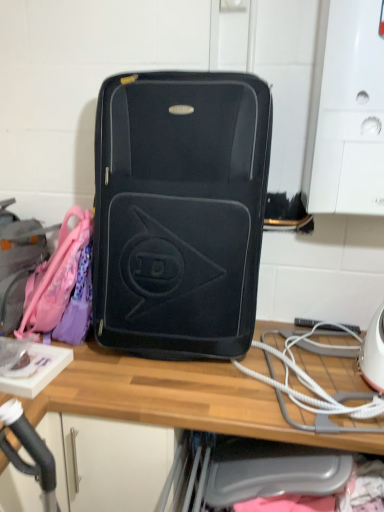
Find the location of a particular element. This screenshot has height=512, width=384. free point above white cord at lower right (from a real-world perspective) is located at coordinates (330, 372).